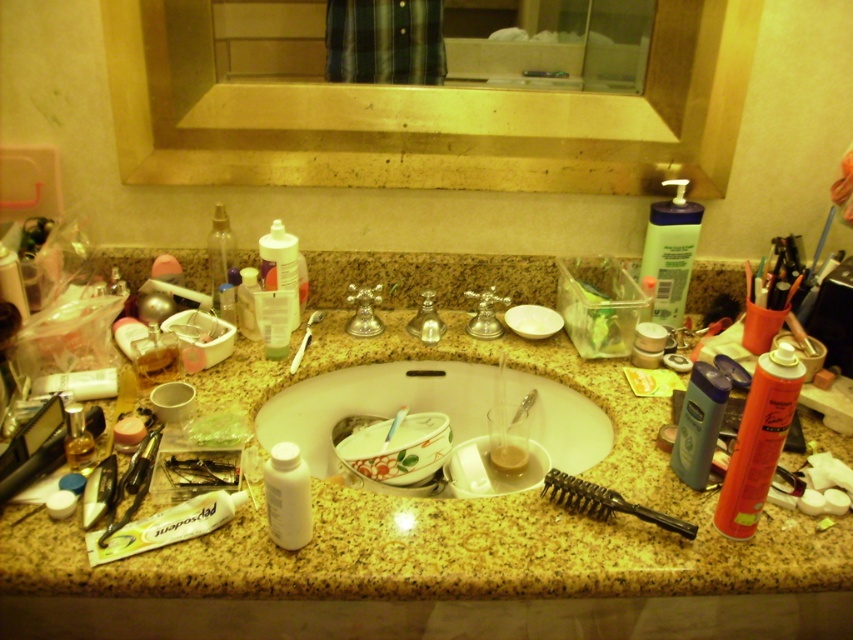
You need to place both the blue plastic shampoo bottle at right and the white plastic bottle at center into a drawer that can only fit one of them. Which one should you choose?

The blue plastic shampoo bottle at right has a larger size compared to the white plastic bottle at center, so you should choose the white plastic bottle at center to fit into the drawer.

You are trying to decide which bottle to grab first. The blue plastic shampoo bottle at right and the white plastic bottle at center are both within reach. Which one has a smaller diameter?

The blue plastic shampoo bottle at right is thinner than the white plastic bottle at center, so it has a smaller diameter.